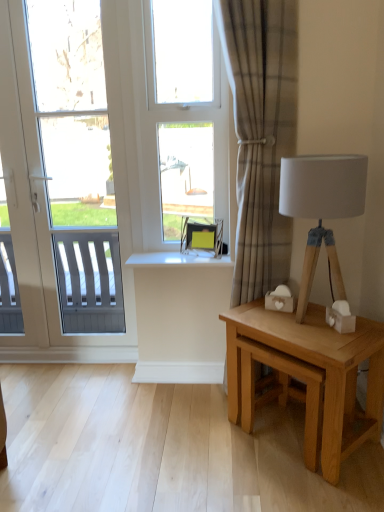
The width and height of the screenshot is (384, 512). What do you see at coordinates (179, 259) in the screenshot?
I see `white glossy window sill at center` at bounding box center [179, 259].

Where is `matte black swivel chair at center`? The height and width of the screenshot is (512, 384). matte black swivel chair at center is located at coordinates (202, 234).

This screenshot has width=384, height=512. Describe the element at coordinates (261, 134) in the screenshot. I see `plaid fabric curtain at center` at that location.

Measure the distance between point (119, 197) and camera.

They are 2.16 meters apart.

Find the location of a particular element. white glossy window sill at center is located at coordinates (179, 259).

Are wooden tripod lamp at right and clear glass window at center located far from each other?

wooden tripod lamp at right is actually quite close to clear glass window at center.

From a real-world perspective, is wooden tripod lamp at right on clear glass window at center?

No, from a real-world perspective, wooden tripod lamp at right is not over clear glass window at center

Considering the sizes of objects wooden tripod lamp at right and clear glass window at center in the image provided, who is taller, wooden tripod lamp at right or clear glass window at center?

With more height is clear glass window at center.

Is plaid fabric curtain at center located outside light brown wooden table at right?

Absolutely, plaid fabric curtain at center is external to light brown wooden table at right.

Which of these two, plaid fabric curtain at center or light brown wooden table at right, is smaller?

With smaller size is light brown wooden table at right.

From the image's perspective, would you say plaid fabric curtain at center is shown under light brown wooden table at right?

Incorrect, from the image's perspective, plaid fabric curtain at center is higher than light brown wooden table at right.

Is plaid fabric curtain at center not near light brown wooden table at right?

They are positioned close to each other.

Can you confirm if white plastic window at left is positioned to the left of wooden tripod lamp at right?

Correct, you'll find white plastic window at left to the left of wooden tripod lamp at right.

Does point (33, 322) come closer to viewer compared to point (364, 157)?

No.

In terms of height, does white plastic window at left look taller or shorter compared to wooden tripod lamp at right?

In the image, white plastic window at left appears to be taller than wooden tripod lamp at right.

How many degrees apart are the facing directions of white plastic window at left and wooden tripod lamp at right?

The angular difference between white plastic window at left and wooden tripod lamp at right is 44.3 degrees.

Considering the relative positions of plaid fabric curtain at center and wooden tripod lamp at right in the image provided, is plaid fabric curtain at center to the right of wooden tripod lamp at right from the viewer's perspective?

In fact, plaid fabric curtain at center is to the left of wooden tripod lamp at right.

From the image's perspective, is plaid fabric curtain at center under wooden tripod lamp at right?

No, from the image's perspective, plaid fabric curtain at center is not beneath wooden tripod lamp at right.

Does plaid fabric curtain at center turn towards wooden tripod lamp at right?

No, plaid fabric curtain at center is not aimed at wooden tripod lamp at right.

Can you tell me how much plaid fabric curtain at center and wooden tripod lamp at right differ in facing direction?

45.3 degrees separate the facing orientations of plaid fabric curtain at center and wooden tripod lamp at right.

From a real-world perspective, between light brown wooden table at right and plaid fabric curtain at center, who is vertically higher?

plaid fabric curtain at center.

Between light brown wooden table at right and plaid fabric curtain at center, which one has more height?

plaid fabric curtain at center.

Is light brown wooden table at right positioned beyond the bounds of plaid fabric curtain at center?

Yes.

Between light brown wooden table at right and plaid fabric curtain at center, which one has smaller width?

Thinner between the two is plaid fabric curtain at center.

Between white glossy window sill at center and matte black swivel chair at center, which one has more height?

With more height is matte black swivel chair at center.

Do you think white glossy window sill at center is within matte black swivel chair at center, or outside of it?

white glossy window sill at center is outside matte black swivel chair at center.

Considering the relative sizes of white glossy window sill at center and matte black swivel chair at center in the image provided, is white glossy window sill at center bigger than matte black swivel chair at center?

Yes.

Locate an element on the screen. swivel chair that appears behind the white glossy window sill at center is located at coordinates (202, 234).

Does white glossy window sill at center turn towards plaid fabric curtain at center?

No, white glossy window sill at center is not facing towards plaid fabric curtain at center.

Between white glossy window sill at center and plaid fabric curtain at center, which one has smaller size?

white glossy window sill at center is smaller.

Is white glossy window sill at center at the right side of plaid fabric curtain at center?

In fact, white glossy window sill at center is to the left of plaid fabric curtain at center.

Is white glossy window sill at center inside the boundaries of plaid fabric curtain at center, or outside?

The correct answer is: outside.

You are a GUI agent. You are given a task and a screenshot of the screen. Output one action in this format:
    pyautogui.click(x=<x>, y=<y>)
    Task: Click on the table lamp in front of the clear glass window at center
    Image resolution: width=384 pixels, height=512 pixels.
    Given the screenshot: What is the action you would take?
    pyautogui.click(x=322, y=208)

Where is `curtain above the light brown wooden table at right (from a real-world perspective)`? The height and width of the screenshot is (512, 384). curtain above the light brown wooden table at right (from a real-world perspective) is located at coordinates (261, 134).

Estimate the real-world distances between objects in this image. Which object is closer to clear glass window at center, plaid fabric curtain at center or white glossy window sill at center?

plaid fabric curtain at center lies closer to clear glass window at center than the other object.

Based on their spatial positions, is clear glass window at center or plaid fabric curtain at center further from wooden tripod lamp at right?

Based on the image, clear glass window at center appears to be further to wooden tripod lamp at right.

When comparing their distances from wooden tripod lamp at right, does plaid fabric curtain at center or white glossy window sill at center seem further?

The object further to wooden tripod lamp at right is white glossy window sill at center.

Consider the image. From the image, which object appears to be nearer to white plastic window at left, white glossy window sill at center or plaid fabric curtain at center?

white glossy window sill at center is positioned closer to the anchor white plastic window at left.

Based on their spatial positions, is light brown wooden table at right or plaid fabric curtain at center further from matte black swivel chair at center?

light brown wooden table at right is further to matte black swivel chair at center.

Estimate the real-world distances between objects in this image. Which object is closer to plaid fabric curtain at center, light brown wooden table at right or clear glass window at center?

Based on the image, clear glass window at center appears to be nearer to plaid fabric curtain at center.

From the image, which object appears to be nearer to wooden tripod lamp at right, white plastic window at left or light brown wooden table at right?

light brown wooden table at right is positioned closer to the anchor wooden tripod lamp at right.

Looking at the image, which one is located closer to clear glass window at center, light brown wooden table at right or white glossy window sill at center?

Among the two, white glossy window sill at center is located nearer to clear glass window at center.

Identify the location of window sill between clear glass window at center and light brown wooden table at right in the up-down direction. This screenshot has height=512, width=384. (179, 259).

The width and height of the screenshot is (384, 512). Identify the location of table lamp located between light brown wooden table at right and matte black swivel chair at center in the depth direction. (322, 208).

Where is `window sill between white plastic window at left and wooden tripod lamp at right in the horizontal direction`? Image resolution: width=384 pixels, height=512 pixels. window sill between white plastic window at left and wooden tripod lamp at right in the horizontal direction is located at coordinates (179, 259).

Locate an element on the screen. The image size is (384, 512). curtain located between wooden tripod lamp at right and white glossy window sill at center in the depth direction is located at coordinates (261, 134).